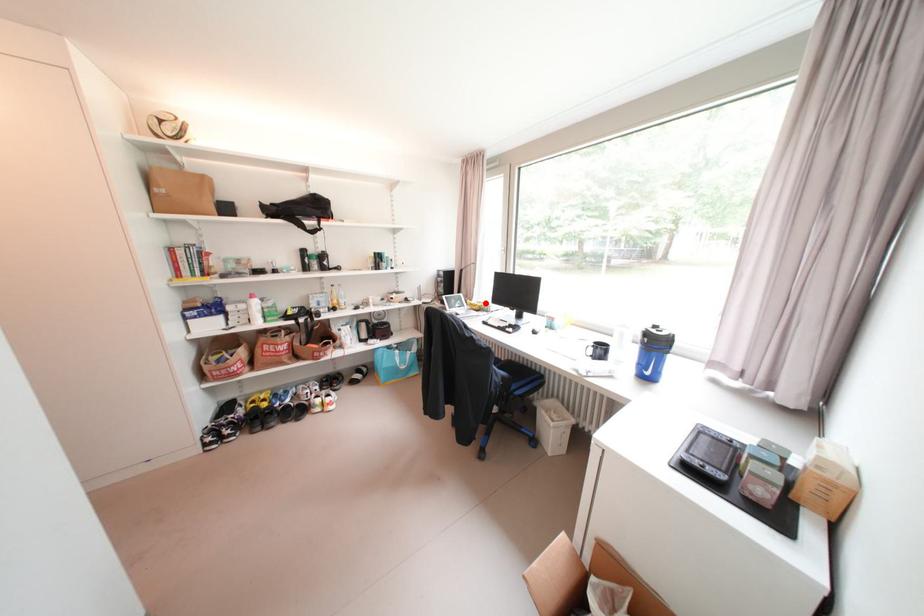
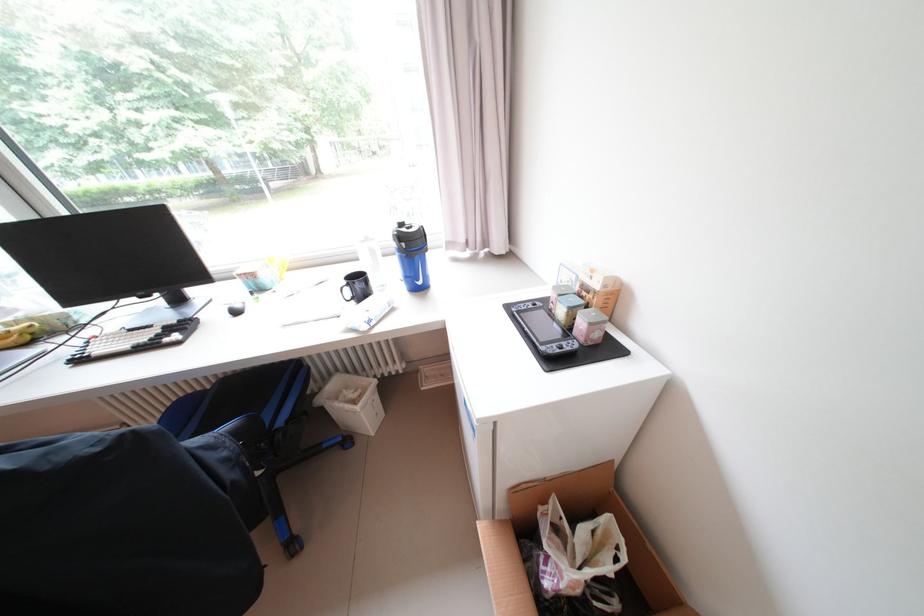
Question: I am providing you with two images of the same scene from different viewpoints. A red point is shown in image1. For the corresponding object point in image2, is it positioned nearer or farther from the camera?

Choices:
 (A) Nearer
 (B) Farther

Answer: (B)